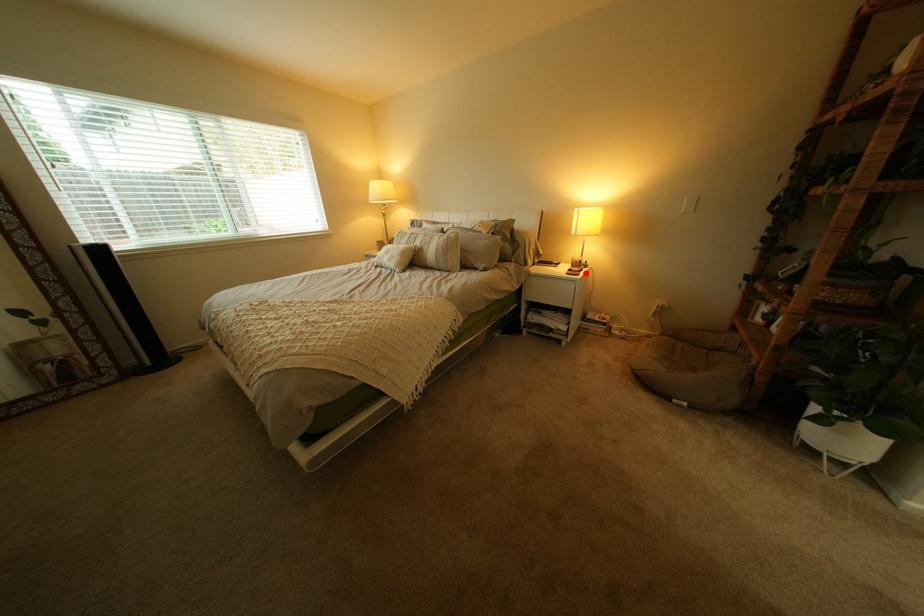
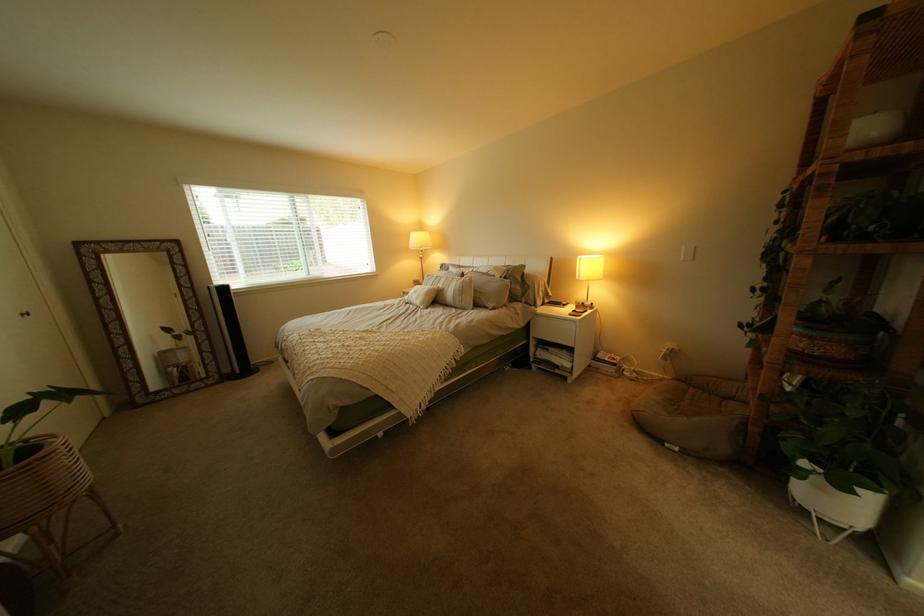
Question: A red point is marked in image1. In image2, is the corresponding 3D point closer to the camera or farther? Reply with the corresponding letter.

Choices:
 (A) The corresponding 3D point is closer.
 (B) The corresponding 3D point is farther.

Answer: (B)